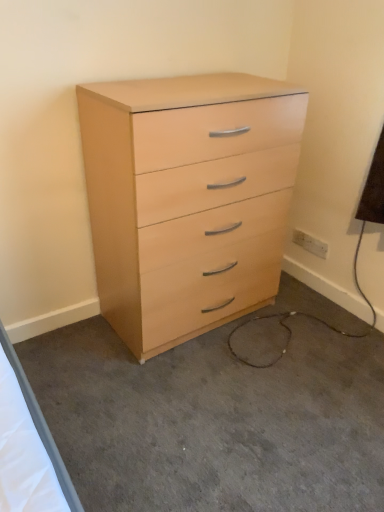
Measure the distance between point (198, 445) and camera.

Point (198, 445) and camera are 4.79 feet apart.

Image resolution: width=384 pixels, height=512 pixels. What do you see at coordinates (214, 421) in the screenshot? I see `light wood dresser at center` at bounding box center [214, 421].

At what (x,y) coordinates should I click in order to perform the action: click on light wood dresser at center. Please return your answer as a coordinate pair (x, y). Looking at the image, I should click on (214, 421).

Is point (259, 496) farther from camera compared to point (209, 163)?

No, it is in front of (209, 163).

From a real-world perspective, relative to light wood/finish chest of drawers at center, is light wood dresser at center vertically above or below?

From a real-world perspective, light wood dresser at center is physically below light wood/finish chest of drawers at center.

Between light wood dresser at center and light wood/finish chest of drawers at center, which one has smaller size?

With smaller size is light wood dresser at center.

Is light wood dresser at center far away from light wood/finish chest of drawers at center?

light wood dresser at center is actually quite close to light wood/finish chest of drawers at center.

From the image's perspective, between white plastic electric outlet at lower right and light wood dresser at center, which one is located above?

white plastic electric outlet at lower right.

Is white plastic electric outlet at lower right not close to light wood dresser at center?

Yes.

In terms of size, does white plastic electric outlet at lower right appear bigger or smaller than light wood dresser at center?

Clearly, white plastic electric outlet at lower right is smaller in size than light wood dresser at center.

From the image's perspective, is light wood/finish chest of drawers at center below light wood dresser at center?

Actually, light wood/finish chest of drawers at center appears above light wood dresser at center in the image.

Are light wood/finish chest of drawers at center and light wood dresser at center making contact?

No, light wood/finish chest of drawers at center is not next to light wood dresser at center.

Does light wood/finish chest of drawers at center have a lesser height compared to light wood dresser at center?

No, light wood/finish chest of drawers at center is not shorter than light wood dresser at center.

Is white plastic electric outlet at lower right at the back of light wood/finish chest of drawers at center?

light wood/finish chest of drawers at center does not have its back to white plastic electric outlet at lower right.

Considering the relative positions of light wood/finish chest of drawers at center and white plastic electric outlet at lower right in the image provided, is light wood/finish chest of drawers at center to the right of white plastic electric outlet at lower right from the viewer's perspective?

No, light wood/finish chest of drawers at center is not to the right of white plastic electric outlet at lower right.

Which is in front, light wood/finish chest of drawers at center or white plastic electric outlet at lower right?

light wood/finish chest of drawers at center is closer to the camera.

Which object is thinner, light wood/finish chest of drawers at center or white plastic electric outlet at lower right?

With smaller width is white plastic electric outlet at lower right.

How many degrees apart are the facing directions of white plastic electric outlet at lower right and light wood/finish chest of drawers at center?

90.3 degrees separate the facing orientations of white plastic electric outlet at lower right and light wood/finish chest of drawers at center.

In terms of width, does white plastic electric outlet at lower right look wider or thinner when compared to light wood/finish chest of drawers at center?

Considering their sizes, white plastic electric outlet at lower right looks slimmer than light wood/finish chest of drawers at center.

Can you confirm if white plastic electric outlet at lower right is shorter than light wood/finish chest of drawers at center?

Yes, white plastic electric outlet at lower right is shorter than light wood/finish chest of drawers at center.

Is point (316, 238) behind point (276, 106)?

Yes.

Could white plastic electric outlet at lower right be considered to be inside light wood dresser at center?

Actually, white plastic electric outlet at lower right is outside light wood dresser at center.

Between light wood dresser at center and white plastic electric outlet at lower right, which one appears on the right side from the viewer's perspective?

white plastic electric outlet at lower right.

Is light wood dresser at center taller than white plastic electric outlet at lower right?

No.

In order to click on the chest of drawers above the light wood dresser at center (from the image's perspective) in this screenshot , I will do `click(188, 199)`.

Find the location of a particular element. This screenshot has height=512, width=384. concrete below the white plastic electric outlet at lower right (from a real-world perspective) is located at coordinates (214, 421).

Which object lies nearer to the anchor point white plastic electric outlet at lower right, light wood/finish chest of drawers at center or light wood dresser at center?

Among the two, light wood/finish chest of drawers at center is located nearer to white plastic electric outlet at lower right.

Looking at the image, which one is located further to white plastic electric outlet at lower right, light wood dresser at center or light wood/finish chest of drawers at center?

light wood dresser at center is further to white plastic electric outlet at lower right.

In the scene shown: When comparing their distances from light wood dresser at center, does light wood/finish chest of drawers at center or white plastic electric outlet at lower right seem further?

The object further to light wood dresser at center is white plastic electric outlet at lower right.

From the image, which object appears to be nearer to light wood/finish chest of drawers at center, light wood dresser at center or white plastic electric outlet at lower right?

light wood dresser at center is closer to light wood/finish chest of drawers at center.

Consider the image. Considering their positions, is white plastic electric outlet at lower right positioned further to light wood/finish chest of drawers at center than light wood dresser at center?

Among the two, white plastic electric outlet at lower right is located further to light wood/finish chest of drawers at center.

Consider the image. Estimate the real-world distances between objects in this image. Which object is closer to light wood dresser at center, white plastic electric outlet at lower right or light wood/finish chest of drawers at center?

Based on the image, light wood/finish chest of drawers at center appears to be nearer to light wood dresser at center.

Identify the location of chest of drawers between light wood dresser at center and white plastic electric outlet at lower right from front to back. (188, 199).